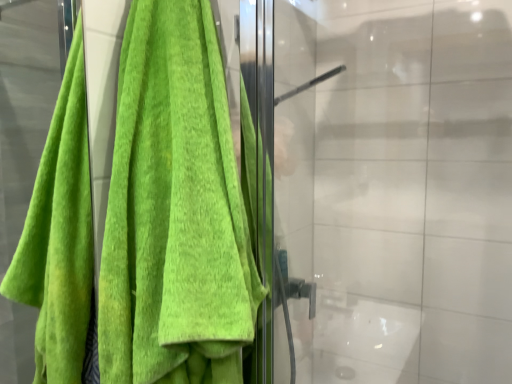
Question: Can you confirm if green terry cloth towel at left is smaller than transparent glass door at center?

Choices:
 (A) no
 (B) yes

Answer: (B)

Question: Can you confirm if green terry cloth towel at left is thinner than transparent glass door at center?

Choices:
 (A) no
 (B) yes

Answer: (B)

Question: Is green terry cloth towel at left bigger than transparent glass door at center?

Choices:
 (A) no
 (B) yes

Answer: (A)

Question: Is green terry cloth towel at left oriented towards transparent glass door at center?

Choices:
 (A) yes
 (B) no

Answer: (B)

Question: Is green terry cloth towel at left to the right of transparent glass door at center from the viewer's perspective?

Choices:
 (A) no
 (B) yes

Answer: (A)

Question: Does green terry cloth towel at left have a greater height compared to transparent glass door at center?

Choices:
 (A) no
 (B) yes

Answer: (A)

Question: Considering the relative sizes of transparent glass door at center and green terry cloth towel at left in the image provided, is transparent glass door at center thinner than green terry cloth towel at left?

Choices:
 (A) yes
 (B) no

Answer: (B)

Question: Considering the relative sizes of transparent glass door at center and green terry cloth towel at left in the image provided, is transparent glass door at center smaller than green terry cloth towel at left?

Choices:
 (A) no
 (B) yes

Answer: (A)

Question: Is transparent glass door at center not near green terry cloth towel at left?

Choices:
 (A) no
 (B) yes

Answer: (A)

Question: Considering the relative positions of transparent glass door at center and green terry cloth towel at left in the image provided, is transparent glass door at center behind green terry cloth towel at left?

Choices:
 (A) no
 (B) yes

Answer: (B)

Question: From a real-world perspective, is transparent glass door at center beneath green terry cloth towel at left?

Choices:
 (A) no
 (B) yes

Answer: (B)

Question: Is green terry cloth towel at left located within transparent glass door at center?

Choices:
 (A) yes
 (B) no

Answer: (B)

Question: Choose the correct answer: Is green terry cloth towel at left inside transparent glass door at center or outside it?

Choices:
 (A) outside
 (B) inside

Answer: (A)